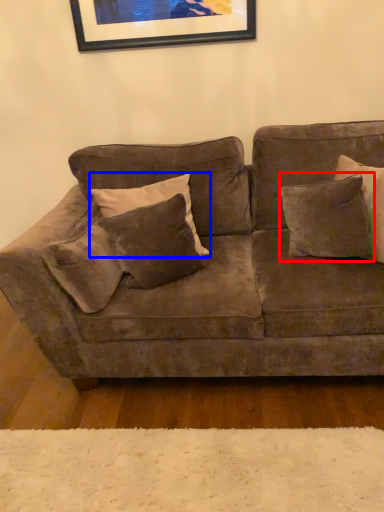
Question: Which of the following is the closest to the observer, pillow (highlighted by a red box) or pillow (highlighted by a blue box)?

Choices:
 (A) pillow
 (B) pillow

Answer: (B)